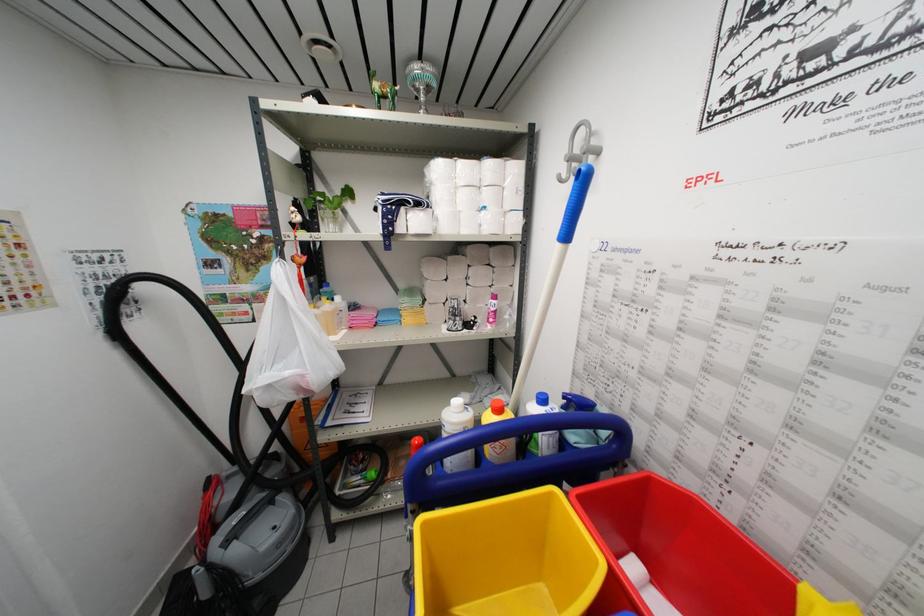
Identify the location of white cleaning bottle. (456, 434).